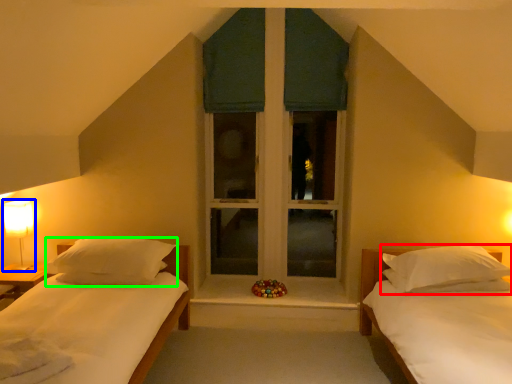
Question: Which object is positioned closest to pillow (highlighted by a red box)? Select from table lamp (highlighted by a blue box) and pillow (highlighted by a green box).

Choices:
 (A) table lamp
 (B) pillow

Answer: (B)